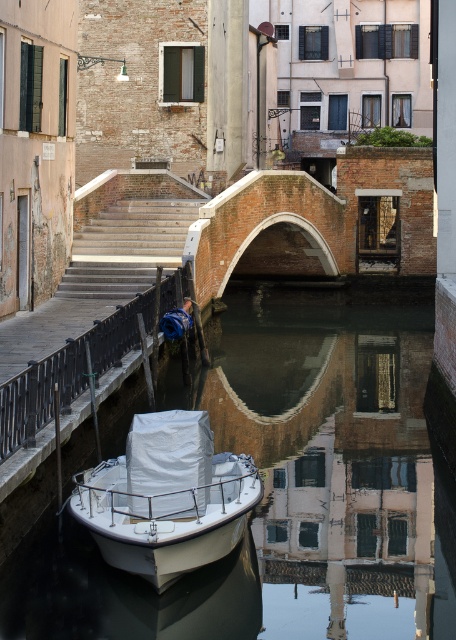
You are a tourist standing on the bridge in the scene. You see the white matte boat at lower center and the smooth metal railing at lower left. Which object is closer to your current position?

The smooth metal railing at lower left is closer to your current position because the white matte boat at lower center is located below it.

You are standing on the smooth metal railing at lower left and want to board the white matte boat at lower center. Which direction should you move to reach it?

The white matte boat at lower center is positioned on the right side of the smooth metal railing at lower left, so you should move to your right to reach it.

You are a tour guide leading a group along the canal. You need to inform your tourists about the distance between the white plastic boat at lower center and the smooth metal railing at lower left. What would you tell them?

The white plastic boat at lower center and the smooth metal railing at lower left are 4.35 meters apart.